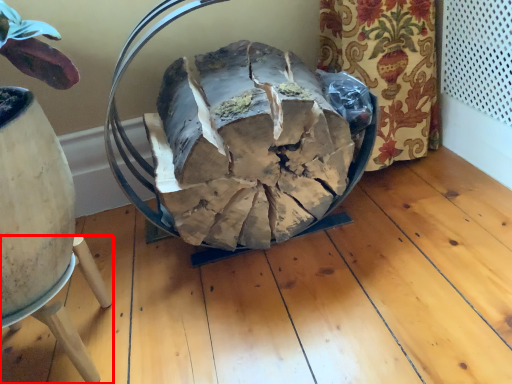
Question: From the image's perspective, what is the correct spatial positioning of furniture (annotated by the red box) in reference to food?

Choices:
 (A) above
 (B) below

Answer: (B)